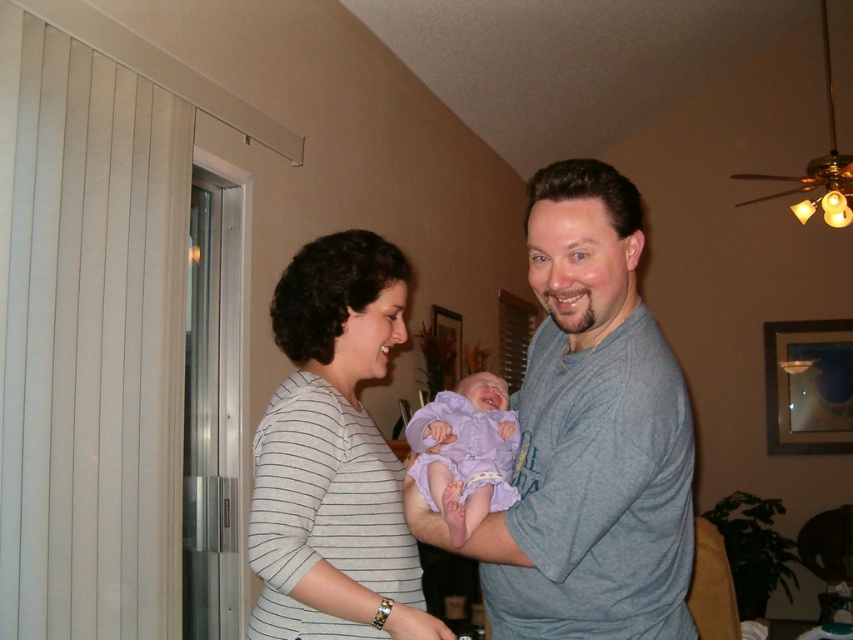
You are a photographer trying to capture a closeup of the baby in the center. You need to focus on the purple satin baby at center first. Will the white striped shirt at center interfere with your focus?

The white striped shirt at center is larger in size than the purple satin baby at center, so it may block the view and interfere with focusing on the purple satin baby at center.

You are a fashion designer looking at the image. You need to decide which shirt, the gray cotton shirt at center or the white striped shirt at center, would be more suitable for a baby. Based on the size comparison between them, which one do you recommend?

The gray cotton shirt at center is larger in size than the white striped shirt at center, so the gray cotton shirt at center would be more suitable for a baby as it provides a better fit considering the baby might need more room to move comfortably.